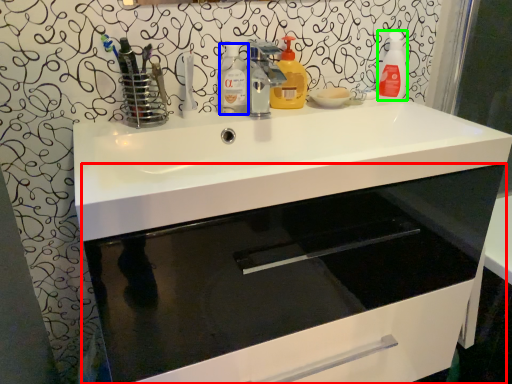
Question: Considering the real-world distances, which object is farthest from bathroom cabinet (highlighted by a red box)? cleaning product (highlighted by a blue box) or cleaning product (highlighted by a green box)?

Choices:
 (A) cleaning product
 (B) cleaning product

Answer: (A)